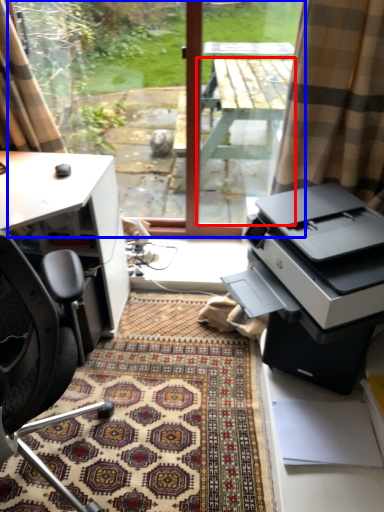
Question: Which object appears closest to the camera in this image, table (highlighted by a red box) or window screen (highlighted by a blue box)?

Choices:
 (A) table
 (B) window screen

Answer: (A)